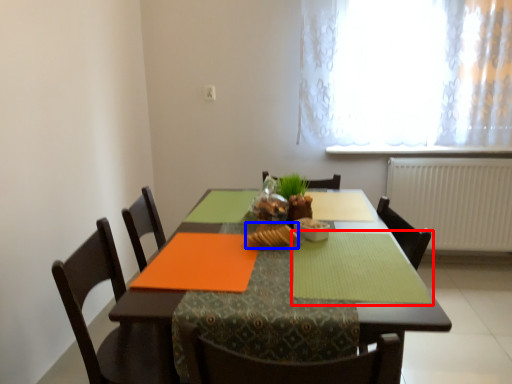
Question: Among these objects, which one is nearest to the camera, place mat (highlighted by a red box) or food (highlighted by a blue box)?

Choices:
 (A) place mat
 (B) food

Answer: (A)